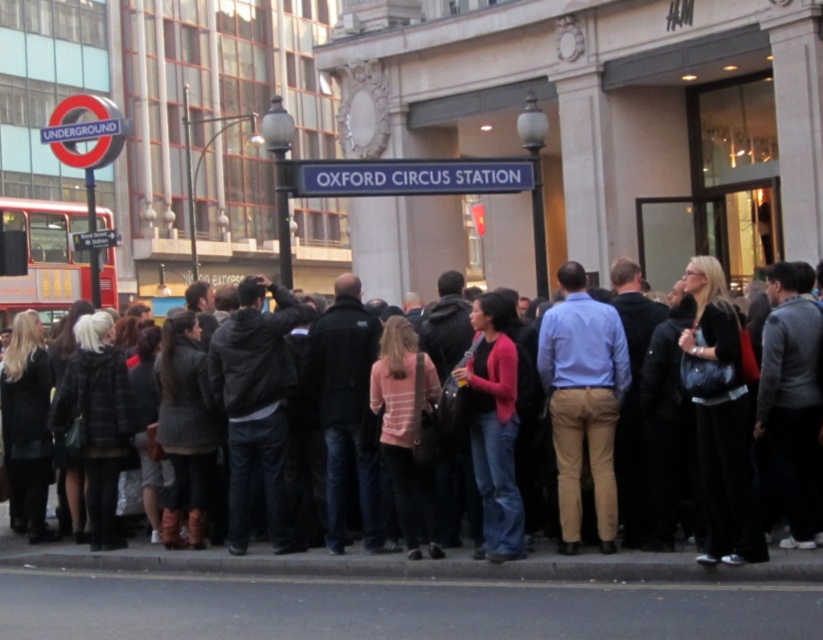
Question: From the image, what is the correct spatial relationship of blue metallic sign at center in relation to red double-decker bus at left?

Choices:
 (A) left
 (B) right

Answer: (B)

Question: Which of the following is the farthest from the observer?

Choices:
 (A) dark gray jacket at center
 (B) matte pink sweater at center

Answer: (B)

Question: Which point is closer to the camera?

Choices:
 (A) red double-decker bus at left
 (B) blue metallic sign at center

Answer: (B)

Question: Is matte pink sweater at center in front of red double-decker bus at left?

Choices:
 (A) no
 (B) yes

Answer: (B)

Question: Which object is farther from the camera taking this photo?

Choices:
 (A) red double-decker bus at left
 (B) matte pink sweater at center

Answer: (A)

Question: Observing the image, what is the correct spatial positioning of dark gray jacket at center in reference to matte pink sweater at center?

Choices:
 (A) right
 (B) left

Answer: (A)